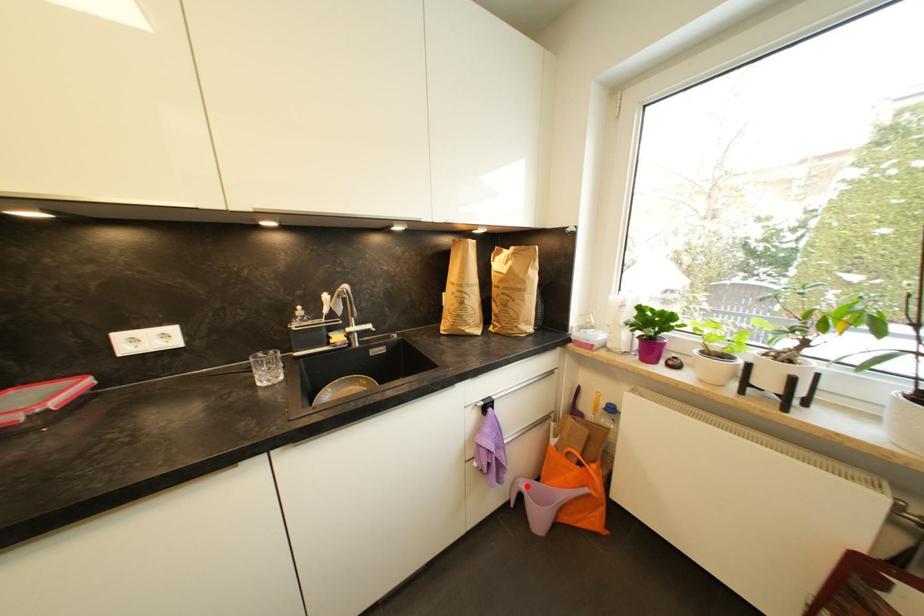
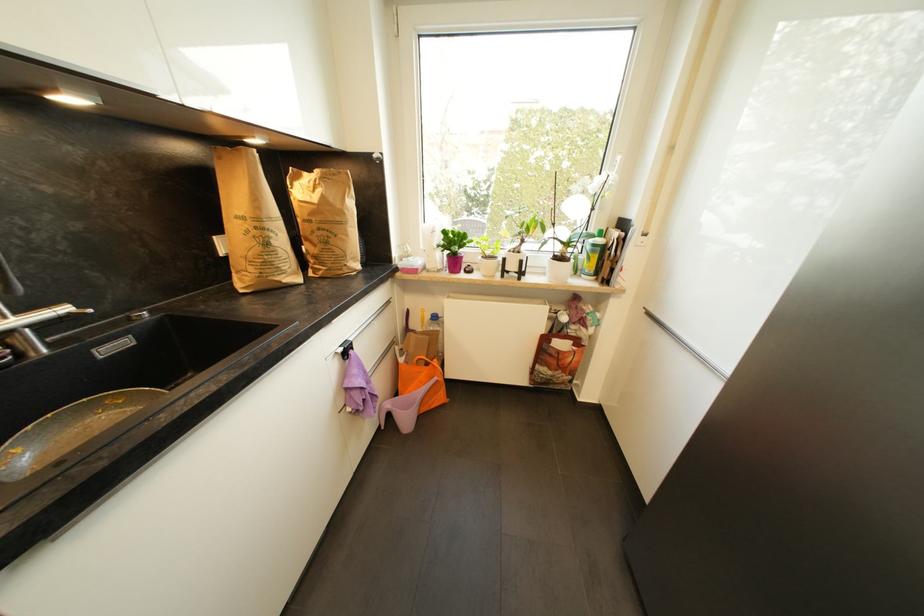
Question: I am providing you with two images of the same scene from different viewpoints. Given a red point in image1, look at the same physical point in image2. Is it:

Choices:
 (A) Closer to the viewpoint
 (B) Farther from the viewpoint

Answer: (A)